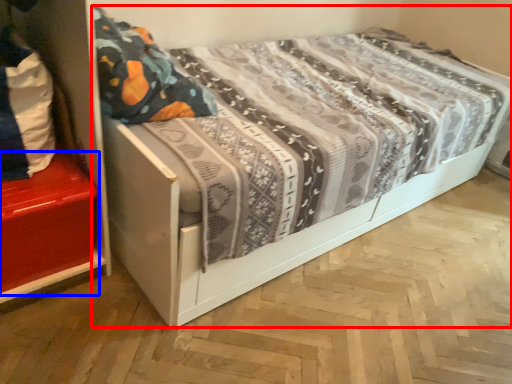
Question: Which of the following is the farthest to the observer, bed (highlighted by a red box) or shelf (highlighted by a blue box)?

Choices:
 (A) bed
 (B) shelf

Answer: (B)